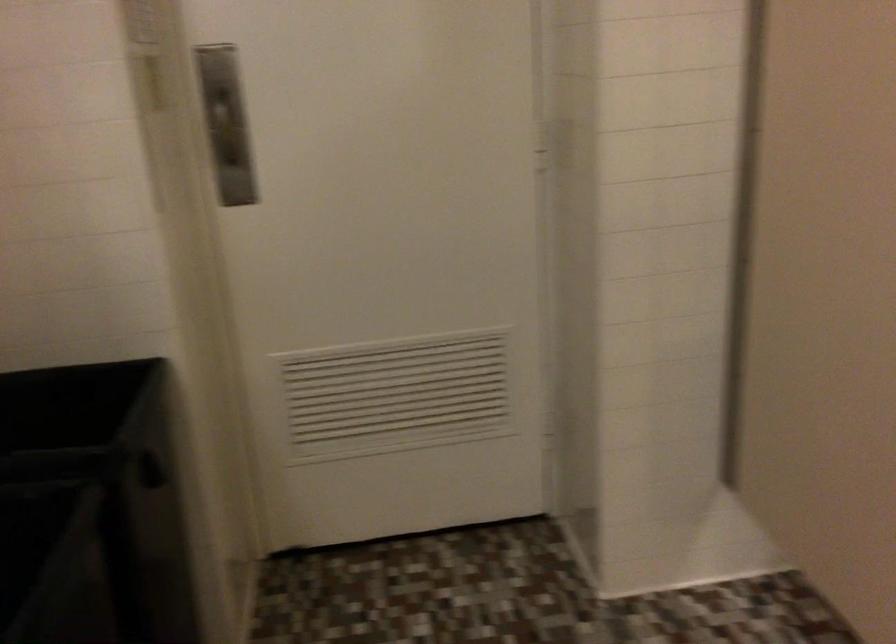
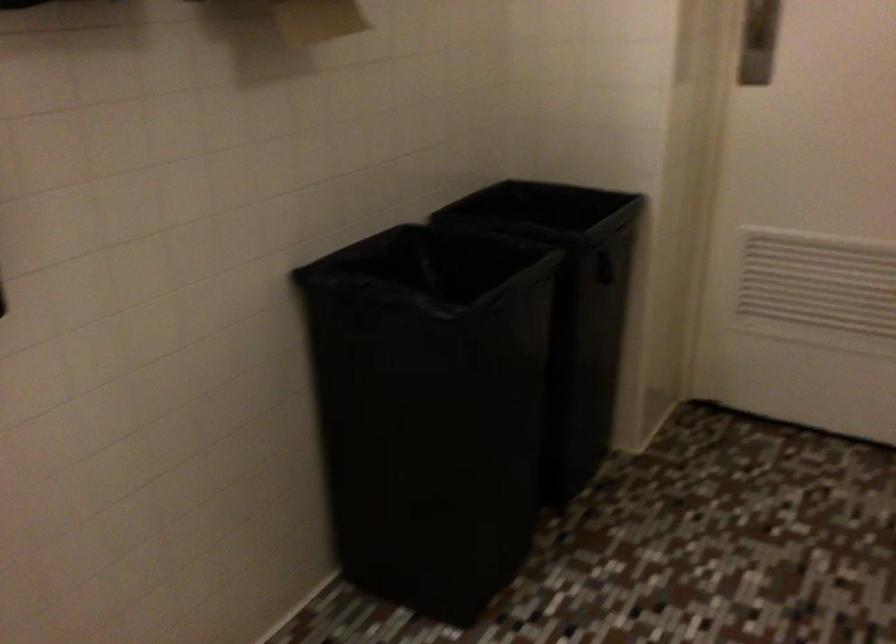
Question: The images are taken continuously from a first-person perspective. In which direction is your viewpoint rotating?

Choices:
 (A) Left
 (B) Right
 (C) Up
 (D) Down

Answer: (A)